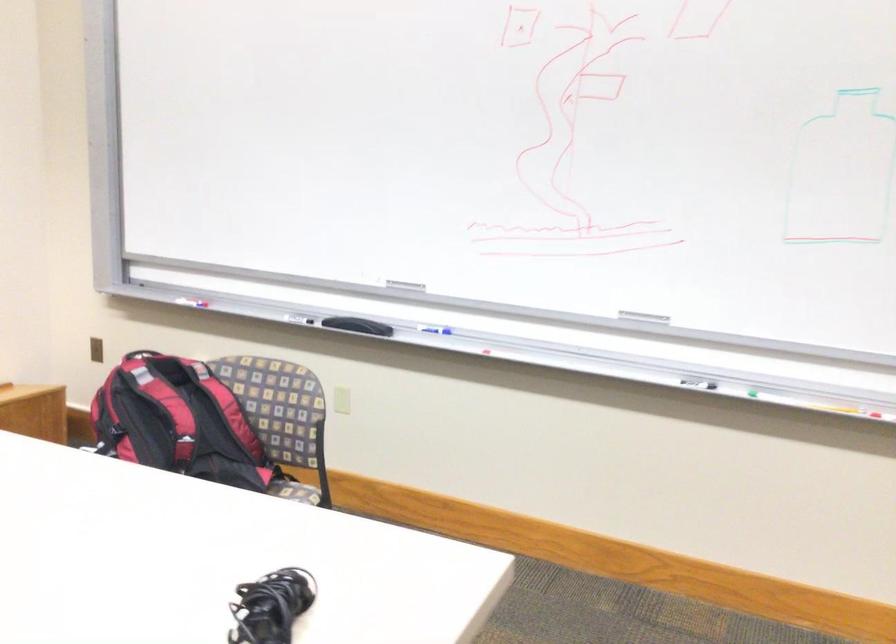
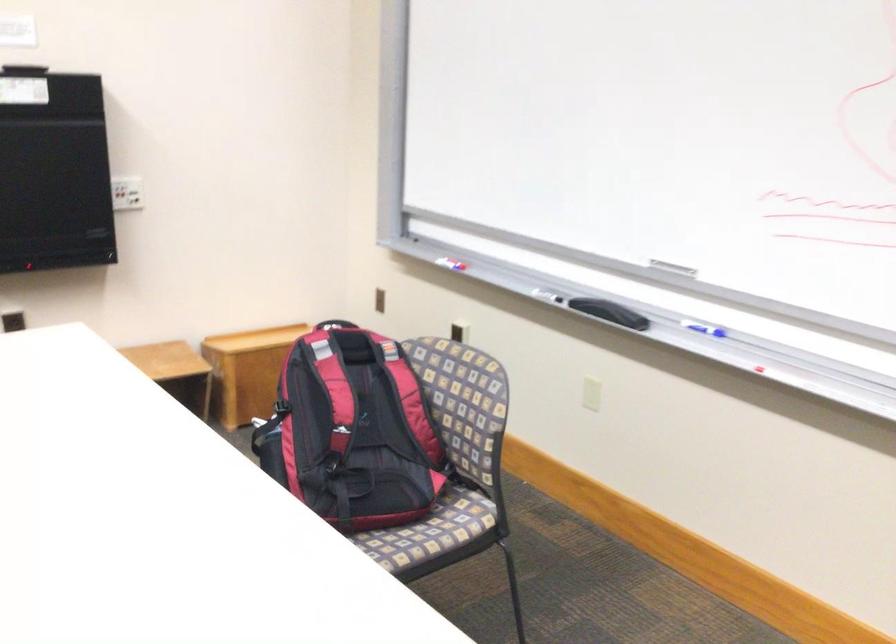
Where in the second image is the point corresponding to point 183,299 from the first image?

(451, 261)